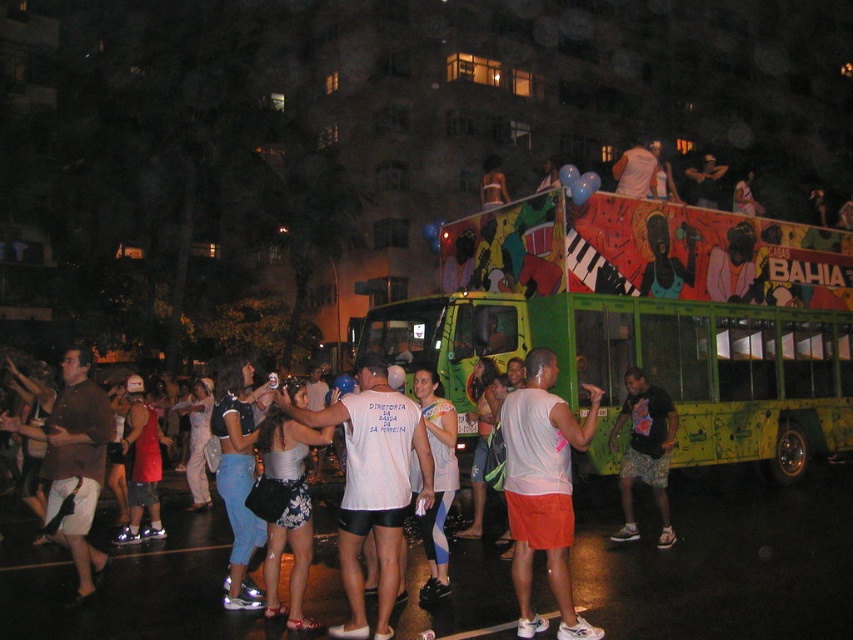
Can you confirm if white satin tank top at center is wider than printed cotton shorts at center?

Incorrect, white satin tank top at center's width does not surpass printed cotton shorts at center's.

Which is more to the left, white satin tank top at center or printed cotton shorts at center?

From the viewer's perspective, white satin tank top at center appears more on the left side.

Is point (281, 470) positioned behind point (639, 470)?

No, (281, 470) is in front of (639, 470).

Where is `white satin tank top at center`? This screenshot has width=853, height=640. white satin tank top at center is located at coordinates (288, 508).

Does white matte shirt at center have a greater width compared to white matte tank top at center?

Yes, white matte shirt at center is wider than white matte tank top at center.

Between white matte shirt at center and white matte tank top at center, which one has more height?

With more height is white matte shirt at center.

Which is behind, point (421, 449) or point (444, 420)?

Positioned behind is point (444, 420).

You are a GUI agent. You are given a task and a screenshot of the screen. Output one action in this format:
    pyautogui.click(x=<x>, y=<y>)
    Task: Click on the white matte shirt at center
    
    Given the screenshot: What is the action you would take?
    pyautogui.click(x=372, y=484)

The image size is (853, 640). Identify the location of white matte shirt at center. (372, 484).

From the picture: Between white matte shirt at center and orange cotton shorts at center, which one is positioned lower?

orange cotton shorts at center

Who is more distant from viewer, (387, 624) or (585, 438)?

Positioned behind is point (387, 624).

Where is `white matte shirt at center`? This screenshot has width=853, height=640. white matte shirt at center is located at coordinates (372, 484).